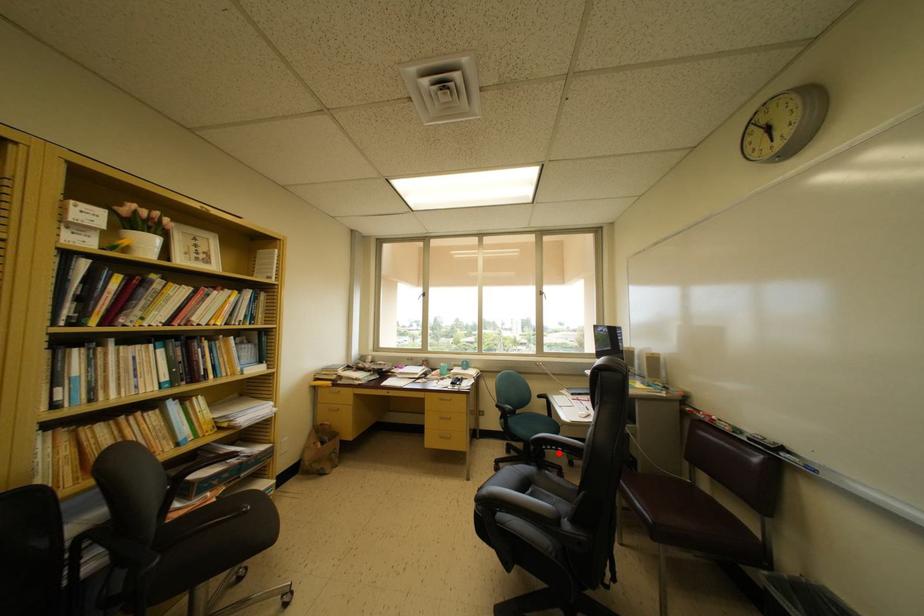
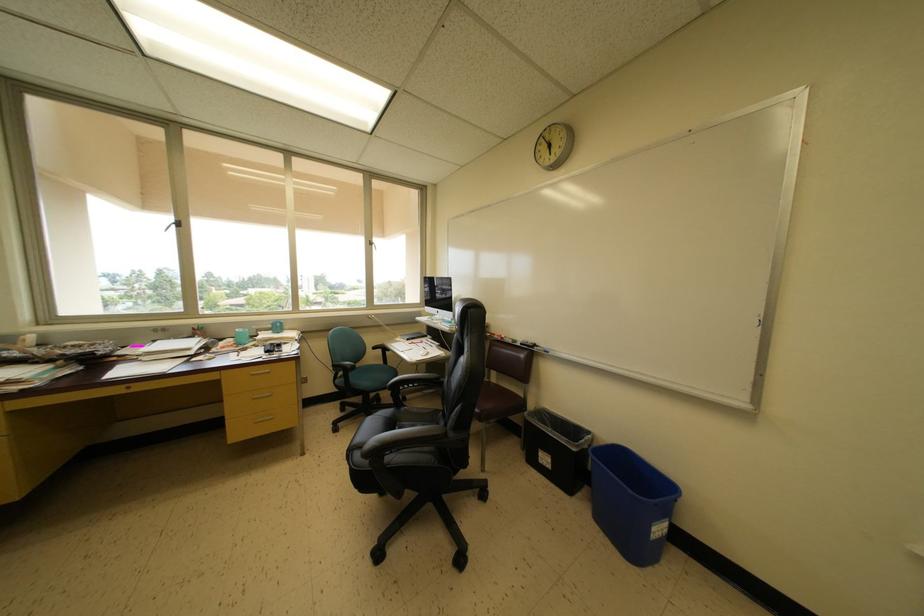
The point at the highlighted location is marked in the first image. Where is the corresponding point in the second image?

(415, 391)